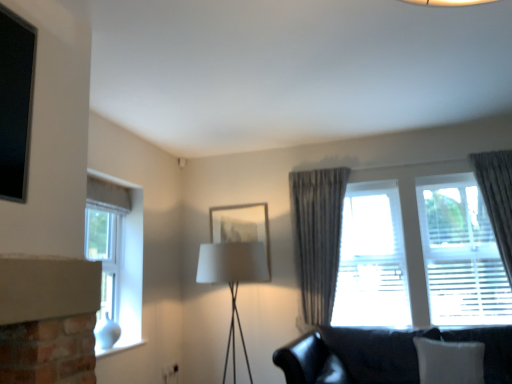
Question: Does white glass window at left, placed as the 2th window when sorted from right to left, lie in front of translucent fabric curtain at right, which is the second window in left-to-right order?

Choices:
 (A) yes
 (B) no

Answer: (A)

Question: From a real-world perspective, does white glass window at left, placed as the 2th window when sorted from right to left, sit lower than translucent fabric curtain at right, which is the second window in left-to-right order?

Choices:
 (A) no
 (B) yes

Answer: (B)

Question: Is white glass window at left, placed as the 2th window when sorted from right to left, surrounding translucent fabric curtain at right, which is the second window in left-to-right order?

Choices:
 (A) no
 (B) yes

Answer: (A)

Question: From the image's perspective, is white glass window at left, the 1th window in the left-to-right sequence, above translucent fabric curtain at right, which is the second window in left-to-right order?

Choices:
 (A) no
 (B) yes

Answer: (A)

Question: Is white glass window at left, the 1th window in the left-to-right sequence, outside translucent fabric curtain at right, which is the second window in left-to-right order?

Choices:
 (A) yes
 (B) no

Answer: (A)

Question: Choose the correct answer: Is white fabric lampshade at center inside matte glass picture frame at center or outside it?

Choices:
 (A) inside
 (B) outside

Answer: (B)

Question: Is point (226, 253) closer or farther from the camera than point (238, 220)?

Choices:
 (A) closer
 (B) farther

Answer: (A)

Question: In the image, is white fabric lampshade at center on the left side or the right side of matte glass picture frame at center?

Choices:
 (A) left
 (B) right

Answer: (B)

Question: Based on their sizes in the image, would you say white fabric lampshade at center is bigger or smaller than matte glass picture frame at center?

Choices:
 (A) small
 (B) big

Answer: (B)

Question: Considering the positions of white glass window at left, the 1th window in the left-to-right sequence, and translucent fabric curtain at right, the 1th window in the right-to-left sequence, in the image, is white glass window at left, the 1th window in the left-to-right sequence, wider or thinner than translucent fabric curtain at right, the 1th window in the right-to-left sequence,?

Choices:
 (A) wide
 (B) thin

Answer: (A)

Question: Relative to translucent fabric curtain at right, the 1th window in the right-to-left sequence, is white glass window at left, placed as the 2th window when sorted from right to left, in front or behind?

Choices:
 (A) front
 (B) behind

Answer: (A)

Question: Considering the positions of white glass window at left, placed as the 2th window when sorted from right to left, and translucent fabric curtain at right, the 1th window in the right-to-left sequence, in the image, is white glass window at left, placed as the 2th window when sorted from right to left, bigger or smaller than translucent fabric curtain at right, the 1th window in the right-to-left sequence,?

Choices:
 (A) big
 (B) small

Answer: (B)

Question: From a real-world perspective, is white glass window at left, the 1th window in the left-to-right sequence, positioned above or below translucent fabric curtain at right, which is the second window in left-to-right order?

Choices:
 (A) below
 (B) above

Answer: (A)

Question: Is white glass window at left, the 1th window in the left-to-right sequence, inside or outside of white fabric lampshade at center?

Choices:
 (A) inside
 (B) outside

Answer: (B)

Question: Is white glass window at left, placed as the 2th window when sorted from right to left, in front of or behind white fabric lampshade at center in the image?

Choices:
 (A) behind
 (B) front

Answer: (B)